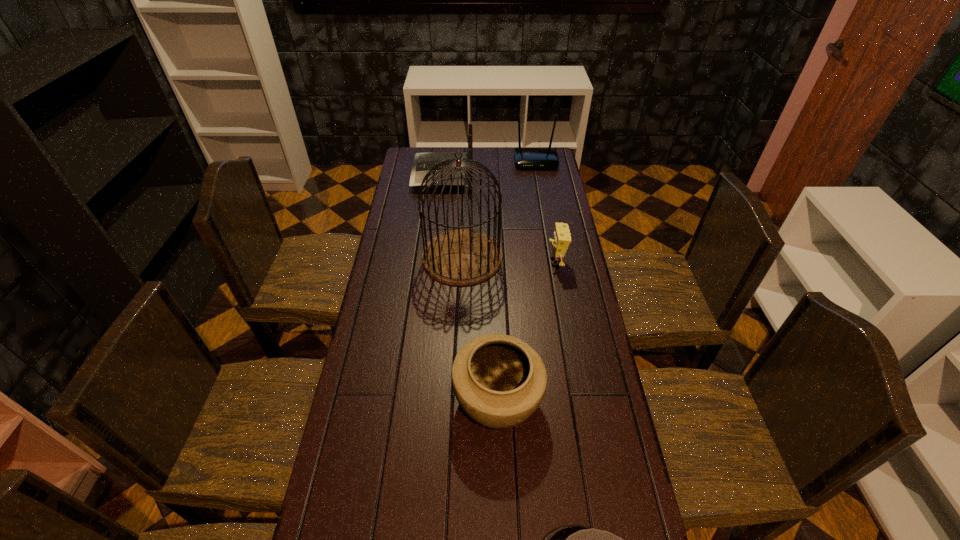
Locate an element on the screen. The width and height of the screenshot is (960, 540). blank space located 0.260m on the face of the sponge is located at coordinates (479, 262).

The image size is (960, 540). Identify the location of blank space located 0.320m on the face of the sponge. (463, 262).

This screenshot has width=960, height=540. Find the location of `vacant space located 0.260m on the face of the sponge`. vacant space located 0.260m on the face of the sponge is located at coordinates [x=479, y=262].

I want to click on birdcage located at the left edge, so click(x=460, y=257).

Where is `router located in the left edge section of the desktop`? The image size is (960, 540). router located in the left edge section of the desktop is located at coordinates (423, 162).

Locate an element on the screen. This screenshot has width=960, height=540. router that is positioned at the right edge is located at coordinates (524, 157).

The image size is (960, 540). What are the coordinates of `sponge present at the right edge` in the screenshot? It's located at (561, 240).

Locate an element on the screen. The width and height of the screenshot is (960, 540). object situated at the far left corner is located at coordinates (423, 162).

Locate an element on the screen. object that is at the far right corner is located at coordinates (524, 157).

Find the location of a particular element. The image size is (960, 540). free point at the left edge is located at coordinates (349, 464).